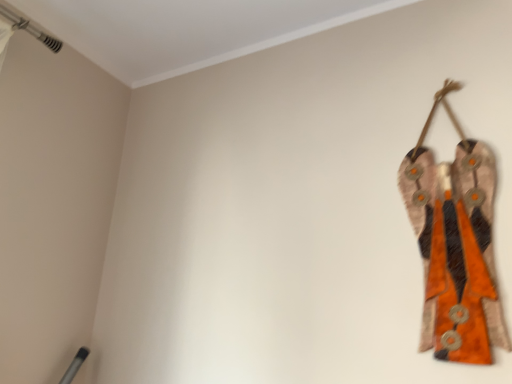
Question: From a real-world perspective, is textured orange fabric at right positioned above or below white smooth ceiling trim at upper left?

Choices:
 (A) below
 (B) above

Answer: (A)

Question: From their relative heights in the image, would you say textured orange fabric at right is taller or shorter than white smooth ceiling trim at upper left?

Choices:
 (A) tall
 (B) short

Answer: (A)

Question: Considering the positions of point (466, 231) and point (414, 0), is point (466, 231) closer or farther from the camera than point (414, 0)?

Choices:
 (A) farther
 (B) closer

Answer: (B)

Question: Is white smooth ceiling trim at upper left bigger or smaller than textured orange fabric at right?

Choices:
 (A) big
 (B) small

Answer: (A)

Question: Is white smooth ceiling trim at upper left spatially inside textured orange fabric at right, or outside of it?

Choices:
 (A) outside
 (B) inside

Answer: (A)

Question: Visually, is white smooth ceiling trim at upper left positioned to the left or to the right of textured orange fabric at right?

Choices:
 (A) right
 (B) left

Answer: (B)

Question: Looking at their shapes, would you say white smooth ceiling trim at upper left is wider or thinner than textured orange fabric at right?

Choices:
 (A) thin
 (B) wide

Answer: (B)